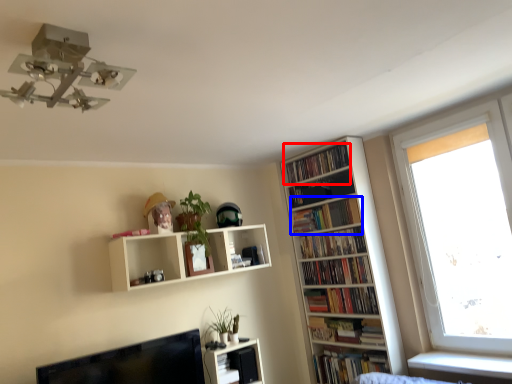
Question: Which point is closer to the camera, book (highlighted by a red box) or book (highlighted by a blue box)?

Choices:
 (A) book
 (B) book

Answer: (B)